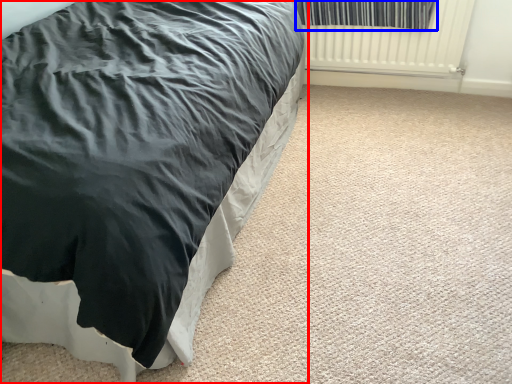
Question: Which of the following is the farthest to the observer, bed (highlighted by a red box) or curtain (highlighted by a blue box)?

Choices:
 (A) bed
 (B) curtain

Answer: (B)